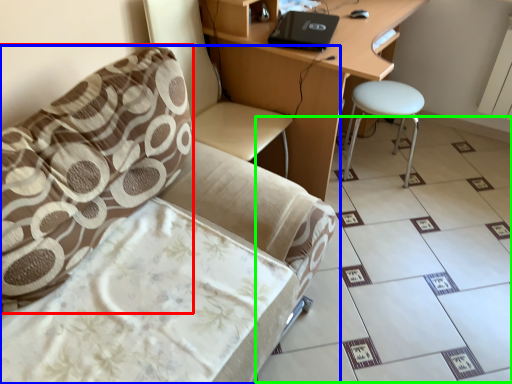
Question: Which is farther away from pillow (highlighted by a red box)? chair (highlighted by a blue box) or ceramic tile (highlighted by a green box)?

Choices:
 (A) chair
 (B) ceramic tile

Answer: (B)